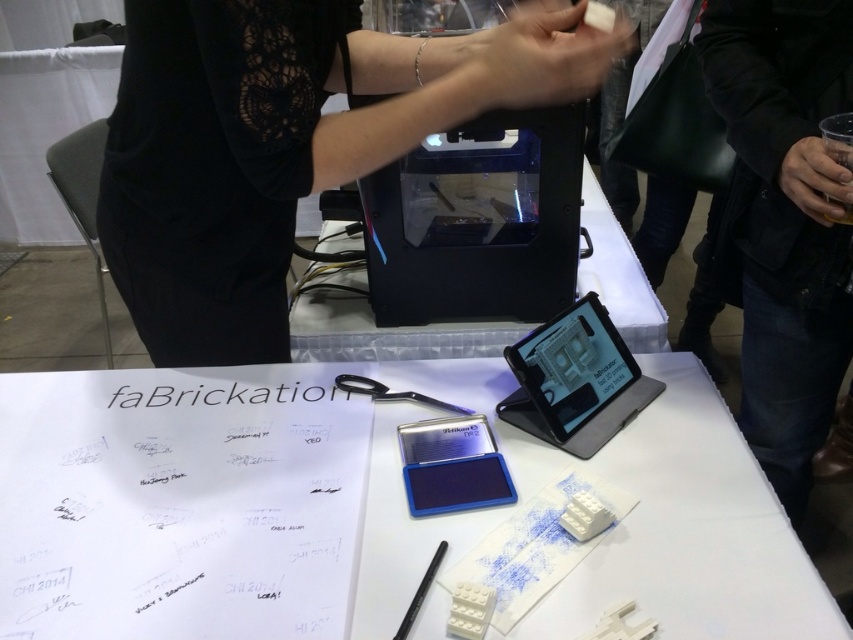
You are standing at the edge of the table and need to reach both the point at [198,490] and the point at [399,396]. Which point should you reach for first to minimize the distance traveled?

You should reach for point [198,490] first because it is closer to you than point [399,396], as it is in front of it.

What object is located at the coordinates point (215, 502)?

The point (215, 502) corresponds to the white matte paper at center.

Consider the image. You are organizing a tech event and need to place both the black plastic tablet at center and the matte black tablet at center on a narrow shelf. Which tablet should you choose to ensure it fits without exceeding the shelf width?

The matte black tablet at center is narrower than the black plastic tablet at center, so choosing the matte black tablet at center would ensure it fits better on the narrow shelf.